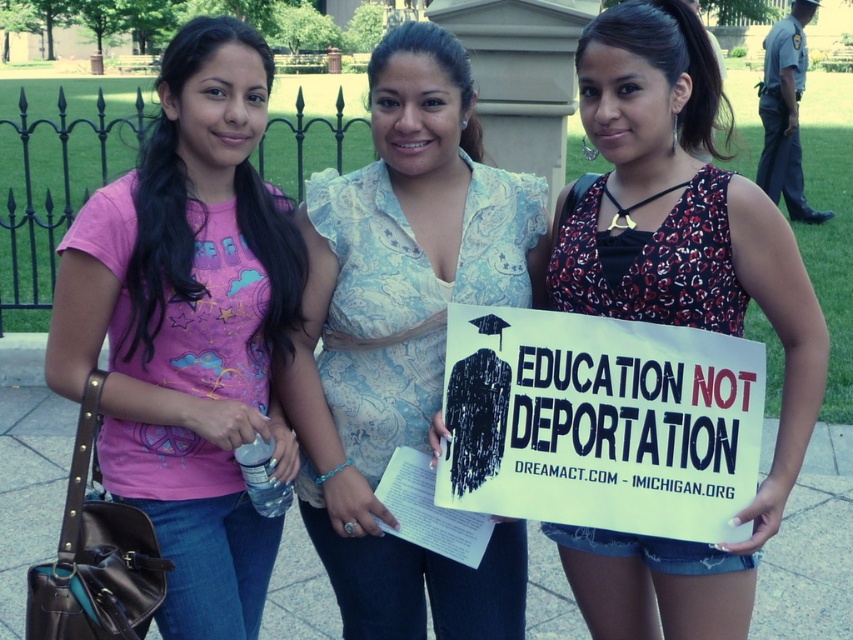
Does light blue paisley blouse at center have a lesser height compared to floral dress at center?

In fact, light blue paisley blouse at center may be taller than floral dress at center.

Is light blue paisley blouse at center bigger than floral dress at center?

Correct, light blue paisley blouse at center is larger in size than floral dress at center.

Between point (398, 378) and point (788, 468), which one is positioned in front?

Point (788, 468)

This screenshot has height=640, width=853. Find the location of `light blue paisley blouse at center`. light blue paisley blouse at center is located at coordinates (405, 337).

From the picture: Does matte pink t-shirt at left come behind light blue paisley blouse at center?

No, it is not.

Consider the image. Which is below, matte pink t-shirt at left or light blue paisley blouse at center?

light blue paisley blouse at center is below.

You are a GUI agent. You are given a task and a screenshot of the screen. Output one action in this format:
    pyautogui.click(x=<x>, y=<y>)
    Task: Click on the matte pink t-shirt at left
    The height and width of the screenshot is (640, 853).
    Given the screenshot: What is the action you would take?
    pyautogui.click(x=189, y=326)

Where is `matte pink t-shirt at left`? The width and height of the screenshot is (853, 640). matte pink t-shirt at left is located at coordinates 189,326.

Which is below, matte pink t-shirt at left or floral dress at center?

matte pink t-shirt at left

Does point (206, 250) come farther from viewer compared to point (657, 616)?

No, it is in front of (657, 616).

The image size is (853, 640). I want to click on matte pink t-shirt at left, so click(189, 326).